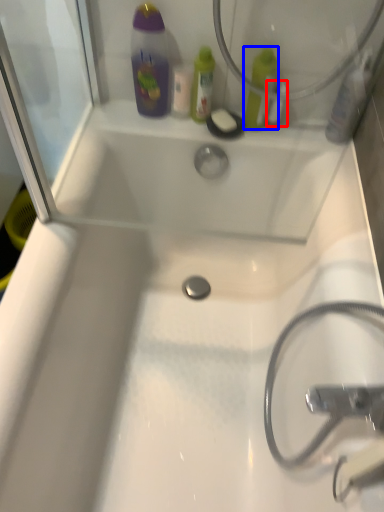
Question: Which object is closer to the camera taking this photo, mouthwash (highlighted by a red box) or mouthwash (highlighted by a blue box)?

Choices:
 (A) mouthwash
 (B) mouthwash

Answer: (B)